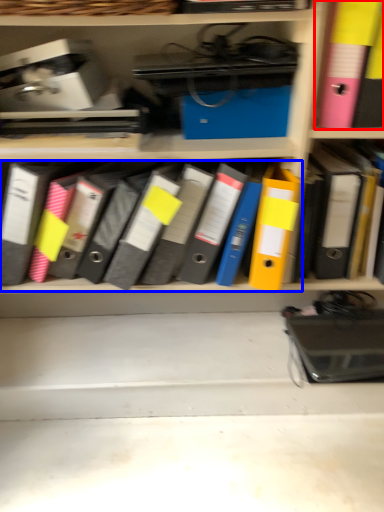
Question: Which of the following is the farthest to the observer, bin (highlighted by a red box) or notebook (highlighted by a blue box)?

Choices:
 (A) bin
 (B) notebook

Answer: (B)